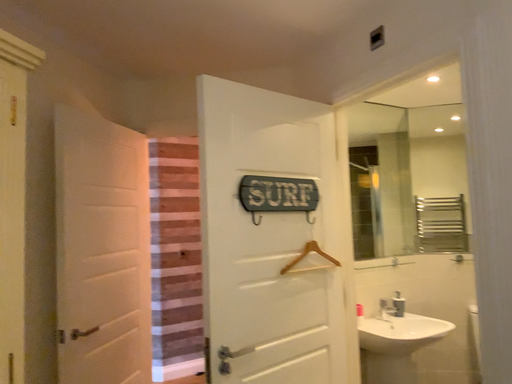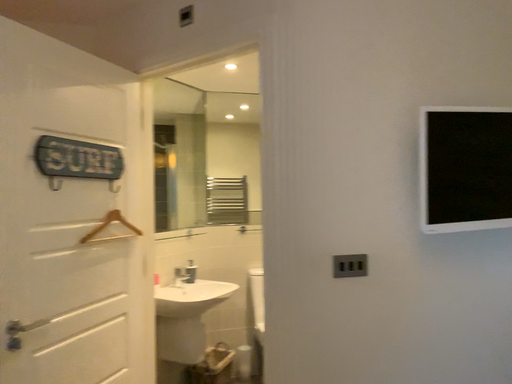
Question: How did the camera likely rotate when shooting the video?

Choices:
 (A) rotated right
 (B) rotated left

Answer: (A)